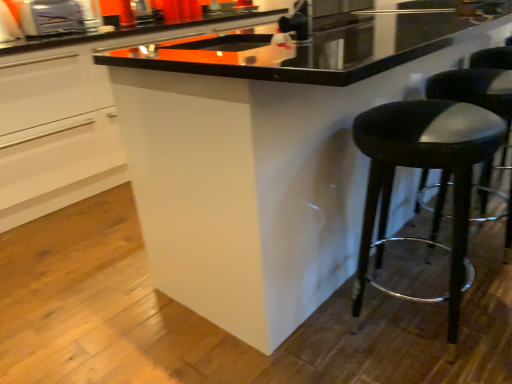
What is the approximate height of metallic silver toaster at upper left?

22.03 centimeters.

You are a GUI agent. You are given a task and a screenshot of the screen. Output one action in this format:
    pyautogui.click(x=<x>, y=<y>)
    Task: Click on the white glossy cabinet at center
    Image resolution: width=512 pixels, height=384 pixels.
    Given the screenshot: What is the action you would take?
    pyautogui.click(x=69, y=121)

Are black leather stool at lower right and white glossy cabinet at center located far from each other?

Yes.

Which point is more distant from viewer, (457, 258) or (76, 148)?

The point (76, 148) is farther from the camera.

Based on their positions, is black leather stool at lower right located to the left or right of white glossy cabinet at center?

black leather stool at lower right is positioned on white glossy cabinet at center's right side.

Based on the photo, from a real-world perspective, is black leather stool at lower right under white glossy cabinet at center?

Yes.

Considering the relative sizes of white glossy cabinet at center and black leather stool at right in the image provided, is white glossy cabinet at center taller than black leather stool at right?

Indeed, white glossy cabinet at center has a greater height compared to black leather stool at right.

Could you tell me if white glossy cabinet at center is facing black leather stool at right?

Yes, white glossy cabinet at center is turned towards black leather stool at right.

Between white glossy cabinet at center and black leather stool at right, which one appears on the left side from the viewer's perspective?

Positioned to the left is white glossy cabinet at center.

Considering their positions, is white glossy cabinet at center located in front of or behind black leather stool at right?

white glossy cabinet at center is positioned farther from the viewer than black leather stool at right.

At what (x,y) coordinates should I click in order to perform the action: click on stool in front of the metallic silver toaster at upper left. Please return your answer as a coordinate pair (x, y). Looking at the image, I should click on (423, 168).

From the picture: Is black leather stool at lower right positioned in front of metallic silver toaster at upper left?

Yes, black leather stool at lower right is closer to the viewer.

Can you confirm if black leather stool at lower right is shorter than metallic silver toaster at upper left?

Incorrect, the height of black leather stool at lower right does not fall short of that of metallic silver toaster at upper left.

In the scene shown: Are black leather stool at lower right and metallic silver toaster at upper left beside each other?

black leather stool at lower right and metallic silver toaster at upper left are not in contact.

Where is `cabinetry beneath the metallic silver toaster at upper left (from a real-world perspective)`? This screenshot has height=384, width=512. cabinetry beneath the metallic silver toaster at upper left (from a real-world perspective) is located at coordinates (69, 121).

How different are the orientations of metallic silver toaster at upper left and white glossy cabinet at center in degrees?

They differ by 1.85 degrees in their facing directions.

Is metallic silver toaster at upper left next to white glossy cabinet at center and touching it?

No, metallic silver toaster at upper left is not in contact with white glossy cabinet at center.

Is metallic silver toaster at upper left positioned beyond the bounds of white glossy cabinet at center?

No, most part of metallic silver toaster at upper left lies within white glossy cabinet at center.

From a real-world perspective, relative to black leather stool at lower right, is metallic silver toaster at upper left vertically above or below?

In terms of real-world spatial position, metallic silver toaster at upper left is above black leather stool at lower right.

Is black leather stool at lower right surrounded by metallic silver toaster at upper left?

Definitely not — black leather stool at lower right is not inside metallic silver toaster at upper left.

Is metallic silver toaster at upper left facing towards black leather stool at lower right?

Yes, metallic silver toaster at upper left is facing black leather stool at lower right.

This screenshot has height=384, width=512. I want to click on bar stool beneath the metallic silver toaster at upper left (from a real-world perspective), so pos(476,90).

Does metallic silver toaster at upper left lie in front of black leather stool at right?

No.

In the scene shown: Can you tell me how much metallic silver toaster at upper left and black leather stool at right differ in facing direction?

179 degrees.

Can you confirm if metallic silver toaster at upper left is wider than black leather stool at right?

In fact, metallic silver toaster at upper left might be narrower than black leather stool at right.

Can you confirm if black leather stool at right is shorter than metallic silver toaster at upper left?

Incorrect, the height of black leather stool at right does not fall short of that of metallic silver toaster at upper left.

Is black leather stool at right located outside metallic silver toaster at upper left?

→ Yes, black leather stool at right is not within metallic silver toaster at upper left.

Is the surface of black leather stool at right in direct contact with metallic silver toaster at upper left?

black leather stool at right and metallic silver toaster at upper left are not in contact.

From a real-world perspective, is black leather stool at right positioned under metallic silver toaster at upper left based on gravity?

Yes.

Find the location of a particular element. The height and width of the screenshot is (384, 512). cabinetry lying on the left of black leather stool at lower right is located at coordinates (69, 121).

At what (x,y) coordinates should I click in order to perform the action: click on bar stool that is under the white glossy cabinet at center (from a real-world perspective). Please return your answer as a coordinate pair (x, y). The width and height of the screenshot is (512, 384). Looking at the image, I should click on (476, 90).

Which object lies nearer to the anchor point black leather stool at right, white glossy cabinet at center or black leather stool at lower right?

black leather stool at lower right lies closer to black leather stool at right than the other object.

When comparing their distances from black leather stool at lower right, does white glossy cabinet at center or black leather stool at right seem closer?

The object closer to black leather stool at lower right is black leather stool at right.

When comparing their distances from metallic silver toaster at upper left, does black leather stool at right or black leather stool at lower right seem further?

black leather stool at lower right lies further to metallic silver toaster at upper left than the other object.

Which object lies further to the anchor point black leather stool at right, white glossy cabinet at center or metallic silver toaster at upper left?

Among the two, metallic silver toaster at upper left is located further to black leather stool at right.

Estimate the real-world distances between objects in this image. Which object is closer to metallic silver toaster at upper left, black leather stool at lower right or white glossy cabinet at center?

Among the two, white glossy cabinet at center is located nearer to metallic silver toaster at upper left.

Considering their positions, is metallic silver toaster at upper left positioned further to black leather stool at right than white glossy cabinet at center?

The object further to black leather stool at right is metallic silver toaster at upper left.

Considering their positions, is black leather stool at right positioned further to black leather stool at lower right than white glossy cabinet at center?

Among the two, white glossy cabinet at center is located further to black leather stool at lower right.

Based on the photo, estimate the real-world distances between objects in this image. Which object is closer to black leather stool at right, black leather stool at lower right or white glossy cabinet at center?

black leather stool at lower right lies closer to black leather stool at right than the other object.

Locate an element on the screen. The image size is (512, 384). cabinetry between metallic silver toaster at upper left and black leather stool at lower right in the horizontal direction is located at coordinates (69, 121).

I want to click on bar stool that lies between white glossy cabinet at center and black leather stool at lower right from top to bottom, so click(x=476, y=90).

You are a GUI agent. You are given a task and a screenshot of the screen. Output one action in this format:
    pyautogui.click(x=<x>, y=<y>)
    Task: Click on the stool located between metallic silver toaster at upper left and black leather stool at right in the left-right direction
    This screenshot has height=384, width=512.
    Given the screenshot: What is the action you would take?
    pos(423,168)

Where is `cabinetry between metallic silver toaster at upper left and black leather stool at right`? This screenshot has width=512, height=384. cabinetry between metallic silver toaster at upper left and black leather stool at right is located at coordinates (69, 121).